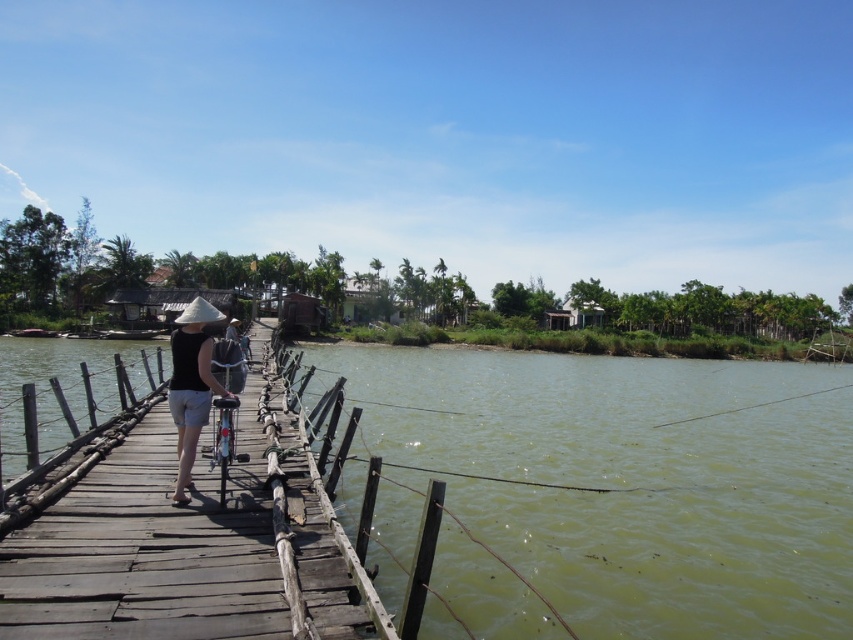
You are a delivery robot with a width of 1 meter. You need to cross the wooden dock at center while avoiding the matte black shirt at center. Is there enough space for you to pass safely?

The wooden dock at center is 1.44 meters away from the matte black shirt at center. Since the robot is 1 meter wide, there is sufficient space to pass safely as the distance between them is greater than the robot width.

Looking at this image, you are standing on the wooden bridge and looking towards the water. There are two points marked on the bridge surface. One is at coordinate point (718,570) and the other is at point (193,404). If you want to step closer to the camera, which point should you move towards?

You should move towards point (193,404) because it is closer to the camera compared to point (718,570).